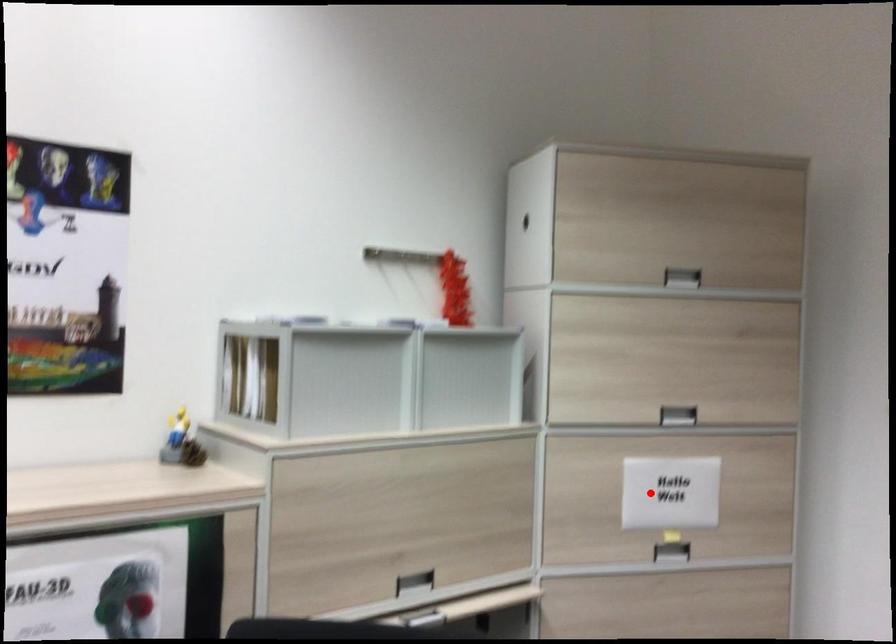
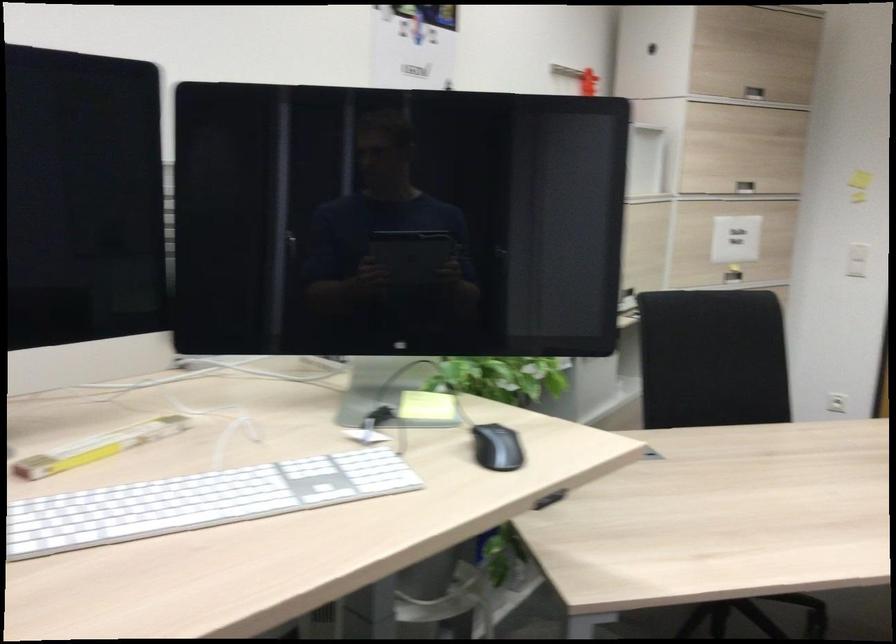
Where in the second image is the point corresponding to the highlighted location from the first image?

(736, 239)